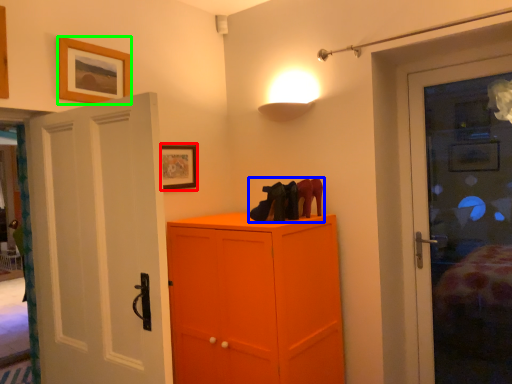
Question: Which is farther away from picture frame (highlighted by a red box)? footwear (highlighted by a blue box) or picture frame (highlighted by a green box)?

Choices:
 (A) footwear
 (B) picture frame

Answer: (A)